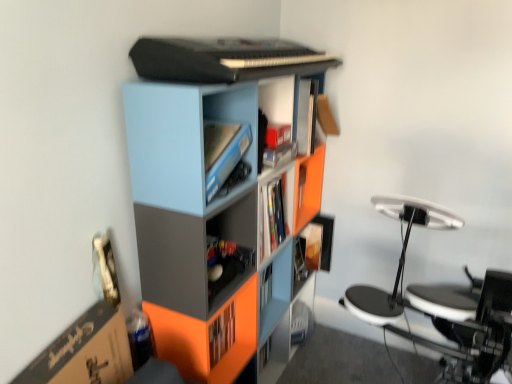
What is the approximate height of light blue plastic cabinet at upper center?

light blue plastic cabinet at upper center is 9.30 inches tall.

In order to face matte plastic bookcase at center, should I rotate leftwards or rightwards?

A 0.578 degree turn to the left will do.

Measure the distance between matte black shelf at center and camera.

The distance of matte black shelf at center from camera is 1.19 meters.

Find the location of `light blue plastic cabinet at upper center`. light blue plastic cabinet at upper center is located at coordinates (182, 140).

From the picture: Could you tell me if matte plastic bookcase at center is facing light blue plastic cabinet at upper center?

Yes, matte plastic bookcase at center is turned towards light blue plastic cabinet at upper center.

From a real-world perspective, is matte plastic bookcase at center over light blue plastic cabinet at upper center?

Actually, matte plastic bookcase at center is physically below light blue plastic cabinet at upper center in the real world.

From the picture: Is matte plastic bookcase at center taller than light blue plastic cabinet at upper center?

Yes, matte plastic bookcase at center is taller than light blue plastic cabinet at upper center.

From the image's perspective, which one is positioned higher, matte plastic bookcase at center or light blue plastic cabinet at upper center?

From the image's view, light blue plastic cabinet at upper center is above.

How much distance is there between matte black shelf at center and matte plastic bookcase at center?

A distance of 5.60 inches exists between matte black shelf at center and matte plastic bookcase at center.

From a real-world perspective, relative to matte plastic bookcase at center, is matte black shelf at center vertically above or below?

matte black shelf at center is above matte plastic bookcase at center.

Is matte black shelf at center taller or shorter than matte plastic bookcase at center?

In the image, matte black shelf at center appears to be shorter than matte plastic bookcase at center.

How many degrees apart are the facing directions of matte black shelf at center and matte plastic bookcase at center?

0.911 degrees.

Does light blue plastic cabinet at upper center contain matte black shelf at center?

No, light blue plastic cabinet at upper center does not contain matte black shelf at center.

Which object is positioned more to the left, light blue plastic cabinet at upper center or matte black shelf at center?

light blue plastic cabinet at upper center.

This screenshot has width=512, height=384. In order to click on cabinet that appears in front of the matte black shelf at center in this screenshot , I will do `click(182, 140)`.

Is matte plastic bookcase at center bigger or smaller than matte black shelf at center?

Considering their sizes, matte plastic bookcase at center takes up more space than matte black shelf at center.

How different are the orientations of matte plastic bookcase at center and matte black shelf at center in degrees?

0.911 degrees.

Is matte plastic bookcase at center aimed at matte black shelf at center?

Yes, matte plastic bookcase at center is facing matte black shelf at center.

From the image's perspective, is matte plastic bookcase at center located above or below matte black shelf at center?

Clearly, from the image's perspective, matte plastic bookcase at center is above matte black shelf at center.

Does light blue plastic cabinet at upper center turn towards matte plastic bookcase at center?

Yes, light blue plastic cabinet at upper center is oriented towards matte plastic bookcase at center.

From the image's perspective, which one is positioned lower, light blue plastic cabinet at upper center or matte plastic bookcase at center?

From the image's view, matte plastic bookcase at center is below.

Considering the sizes of objects light blue plastic cabinet at upper center and matte plastic bookcase at center in the image provided, who is taller, light blue plastic cabinet at upper center or matte plastic bookcase at center?

matte plastic bookcase at center.

Can you tell me how much light blue plastic cabinet at upper center and matte plastic bookcase at center differ in facing direction?

They differ by 1.74 degrees in their facing directions.

Considering the sizes of objects matte black shelf at center and light blue plastic cabinet at upper center in the image provided, who is thinner, matte black shelf at center or light blue plastic cabinet at upper center?

With smaller width is matte black shelf at center.

Is matte black shelf at center facing away from light blue plastic cabinet at upper center?

matte black shelf at center is not turned away from light blue plastic cabinet at upper center.

Is matte black shelf at center smaller than light blue plastic cabinet at upper center?

Correct, matte black shelf at center occupies less space than light blue plastic cabinet at upper center.

From a real-world perspective, is matte black shelf at center physically above light blue plastic cabinet at upper center?

No, from a real-world perspective, matte black shelf at center is not above light blue plastic cabinet at upper center.

What are the coordinates of `cabinet lying behind the matte plastic bookcase at center` in the screenshot? It's located at click(182, 140).

The image size is (512, 384). I want to click on shelf above the matte plastic bookcase at center (from a real-world perspective), so click(x=194, y=254).

Looking at this image, which object lies nearer to the anchor point light blue plastic cabinet at upper center, matte plastic bookcase at center or matte black shelf at center?

matte plastic bookcase at center lies closer to light blue plastic cabinet at upper center than the other object.

Looking at the image, which one is located further to matte black shelf at center, light blue plastic cabinet at upper center or matte plastic bookcase at center?

light blue plastic cabinet at upper center is further to matte black shelf at center.

From the image, which object appears to be farther from matte plastic bookcase at center, light blue plastic cabinet at upper center or matte black shelf at center?

Among the two, light blue plastic cabinet at upper center is located further to matte plastic bookcase at center.

Considering their positions, is matte black shelf at center positioned further to light blue plastic cabinet at upper center than matte plastic bookcase at center?

matte black shelf at center lies further to light blue plastic cabinet at upper center than the other object.

Which object lies further to the anchor point matte black shelf at center, matte plastic bookcase at center or light blue plastic cabinet at upper center?

light blue plastic cabinet at upper center is further to matte black shelf at center.

Based on the photo, considering their positions, is matte black shelf at center positioned further to matte plastic bookcase at center than light blue plastic cabinet at upper center?

Among the two, light blue plastic cabinet at upper center is located further to matte plastic bookcase at center.

At what (x,y) coordinates should I click in order to perform the action: click on bookcase between light blue plastic cabinet at upper center and matte black shelf at center in the up-down direction. Please return your answer as a coordinate pair (x, y). The image size is (512, 384). Looking at the image, I should click on (220, 216).